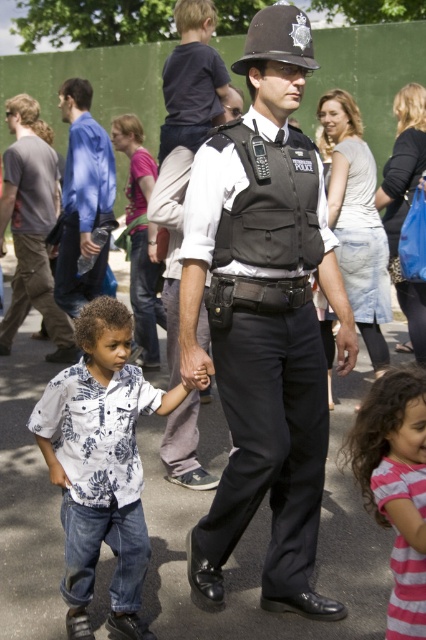
You are a photographer standing at the center of the scene. You want to take a photo that includes both the white floral shirt at lower left and the pink striped dress at lower right. Based on their positions, which one should you adjust your camera angle to focus on first to ensure both are in frame?

The white floral shirt at lower left is above the pink striped dress at lower right, so you should focus on the white floral shirt at lower left first to ensure both are in frame.

You are a photographer trying to capture a group photo of the white floral shirt at lower left and the blue shirt at upper left. Which of the two shirts should you focus on if you want to include both in the frame without cropping either?

The white floral shirt at lower left is wider than the blue shirt at upper left, so you should focus on the white floral shirt at lower left to ensure both fit in the frame without cropping.